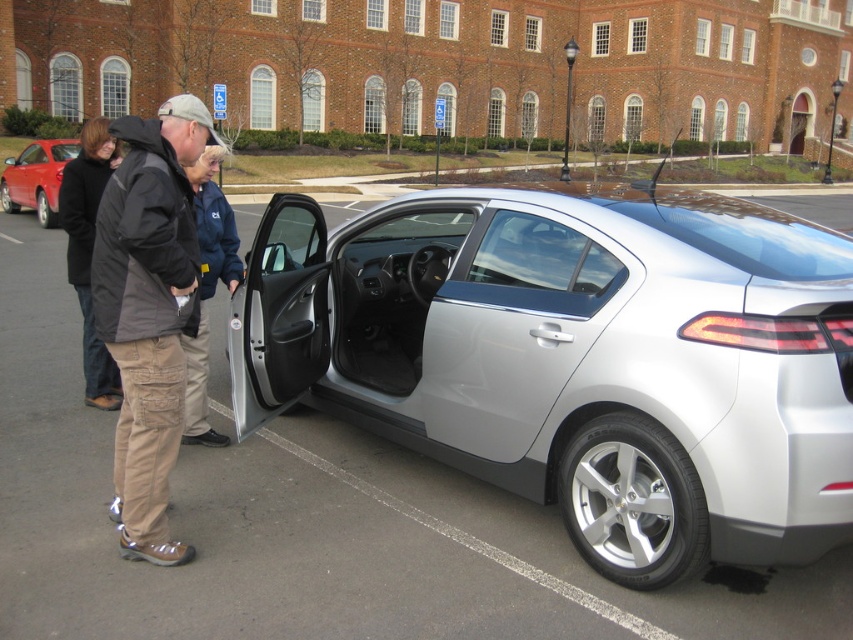
Does silver metallic car door at center have a smaller size compared to matte red sedan at left?

Yes.

Who is taller, silver metallic car door at center or matte red sedan at left?

With more height is matte red sedan at left.

Is point (558, 276) positioned before point (26, 161)?

Yes, point (558, 276) is closer to viewer.

You are a GUI agent. You are given a task and a screenshot of the screen. Output one action in this format:
    pyautogui.click(x=<x>, y=<y>)
    Task: Click on the silver metallic car door at center
    This screenshot has width=853, height=640.
    Given the screenshot: What is the action you would take?
    pyautogui.click(x=515, y=324)

In the scene shown: Can you confirm if silver metallic car at center is wider than khaki cargo pants at left?

Correct, the width of silver metallic car at center exceeds that of khaki cargo pants at left.

Can you confirm if silver metallic car at center is positioned to the left of khaki cargo pants at left?

Indeed, silver metallic car at center is positioned on the left side of khaki cargo pants at left.

Is point (822, 196) positioned after point (152, 346)?

Yes, point (822, 196) is behind point (152, 346).

Locate an element on the screen. This screenshot has height=640, width=853. silver metallic car at center is located at coordinates (310, 528).

Which of these two, silver metallic car door at center or dark blue jacket at center, stands taller?

dark blue jacket at center is taller.

In the scene shown: Between silver metallic car door at center and dark blue jacket at center, which one is positioned lower?

silver metallic car door at center is lower down.

Is point (495, 365) positioned in front of point (207, 260)?

Yes.

Locate an element on the screen. The image size is (853, 640). silver metallic car door at center is located at coordinates (515, 324).